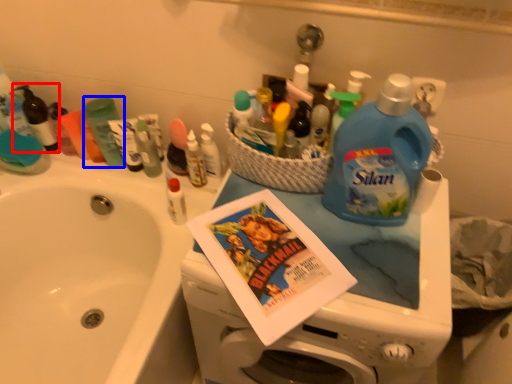
Question: Which object is further to the camera taking this photo, toiletry (highlighted by a red box) or toiletry (highlighted by a blue box)?

Choices:
 (A) toiletry
 (B) toiletry

Answer: (A)